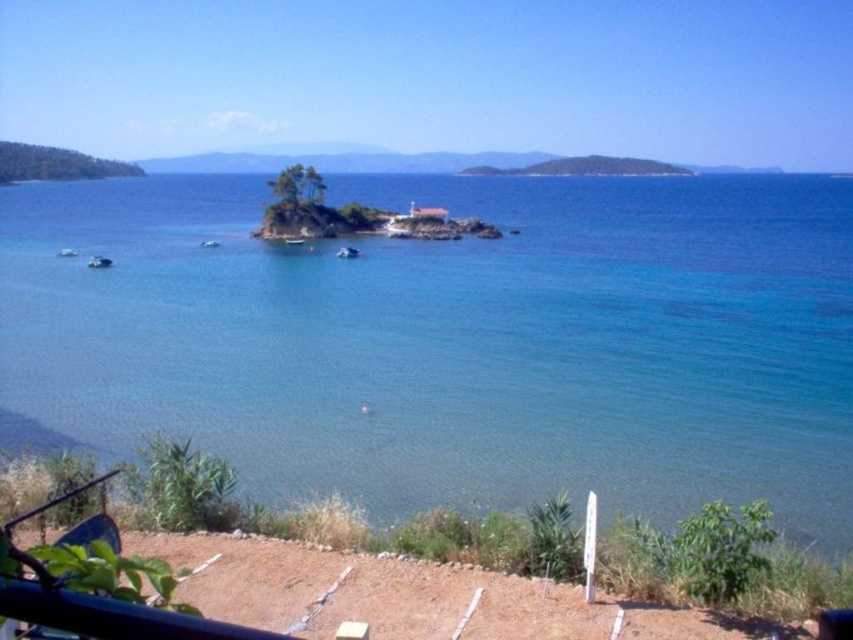
Is clear blue water at center positioned in front of metallic blue boat at left?

Yes, it is.

Identify the location of clear blue water at center. (456, 339).

Who is higher up, clear blue water at center or white glossy boat at center?

Positioned higher is clear blue water at center.

Does clear blue water at center have a lesser width compared to white glossy boat at center?

Incorrect, clear blue water at center's width is not less than white glossy boat at center's.

Who is more forward, (521, 413) or (349, 252)?

Positioned in front is point (521, 413).

Find the location of a particular element. Image resolution: width=853 pixels, height=640 pixels. clear blue water at center is located at coordinates (456, 339).

Does clear blue water at center appear over white plastic boat at lower left?

Yes, clear blue water at center is above white plastic boat at lower left.

This screenshot has width=853, height=640. Find the location of `clear blue water at center`. clear blue water at center is located at coordinates (456, 339).